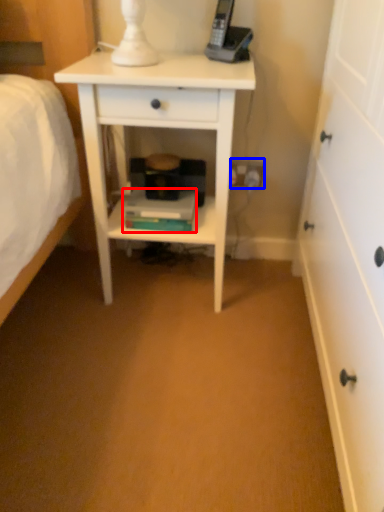
Question: Which object appears closest to the camera in this image, book (highlighted by a red box) or electric outlet (highlighted by a blue box)?

Choices:
 (A) book
 (B) electric outlet

Answer: (A)